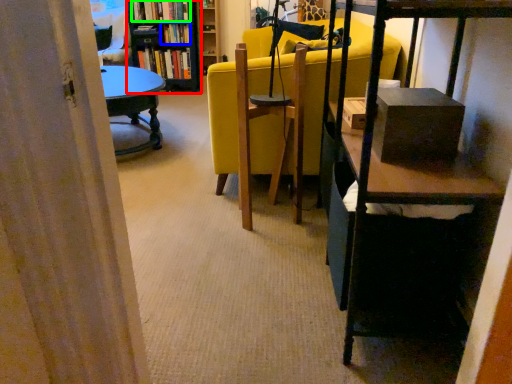
Question: Based on their relative distances, which object is nearer to bookcase (highlighted by a red box)? Choose from book (highlighted by a blue box) and book (highlighted by a green box).

Choices:
 (A) book
 (B) book

Answer: (A)